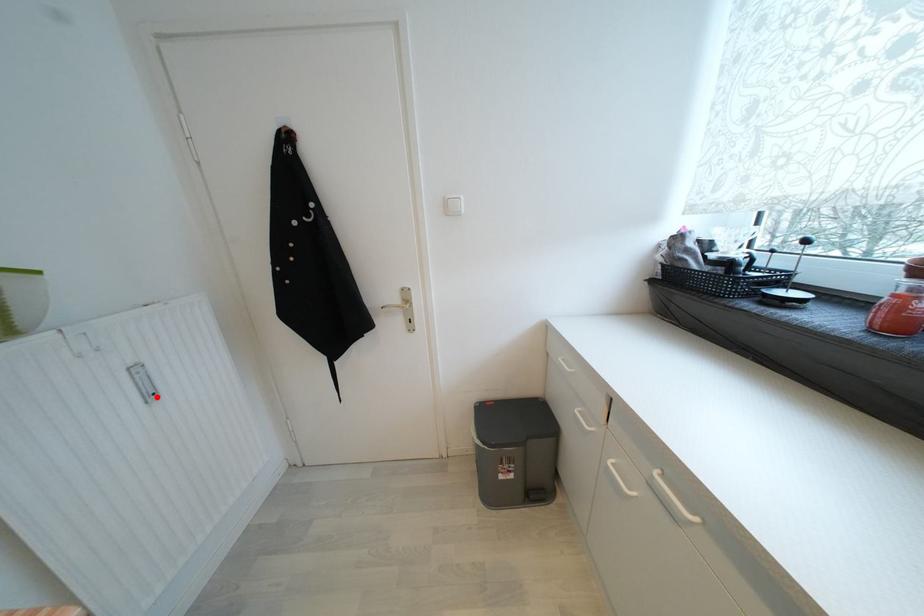
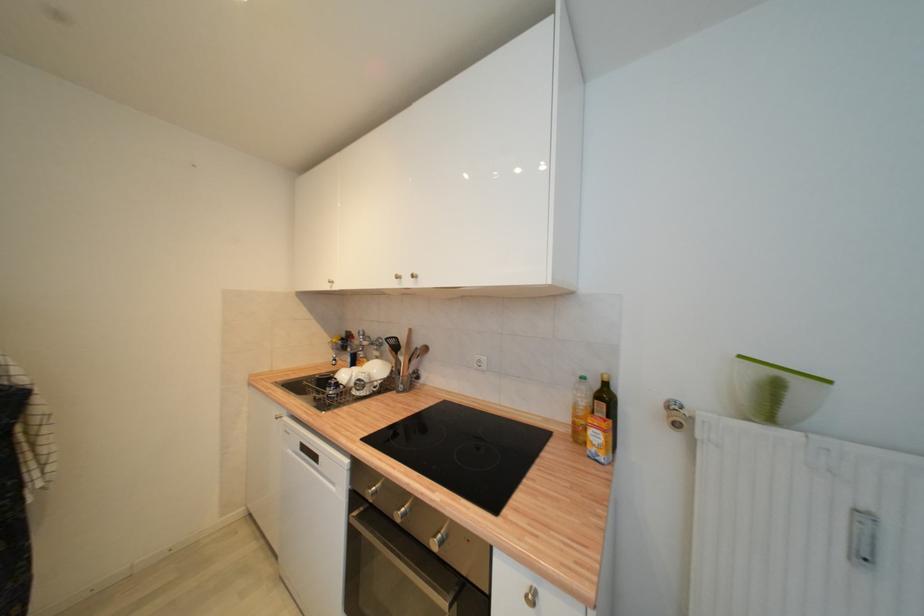
The point at the highlighted location is marked in the first image. Where is the corresponding point in the second image?

(869, 560)